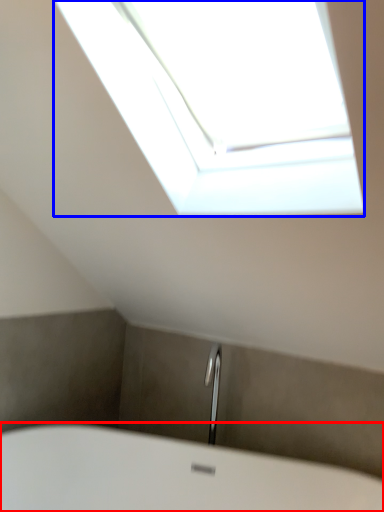
Question: Among these objects, which one is farthest to the camera, bathtub (highlighted by a red box) or window (highlighted by a blue box)?

Choices:
 (A) bathtub
 (B) window

Answer: (A)